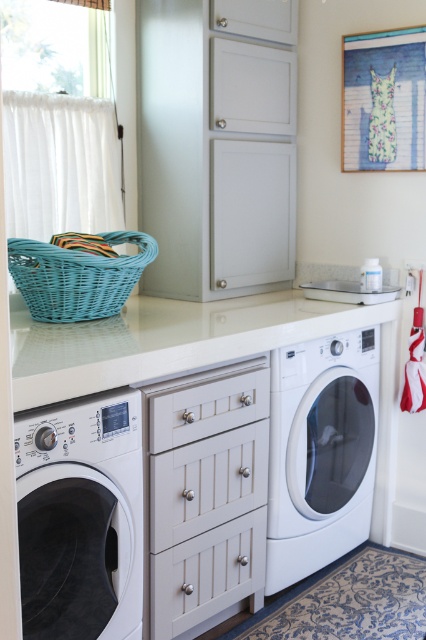
Does point (37, 602) come farther from viewer compared to point (57, 273)?

No, (37, 602) is closer to viewer.

Does white glossy washing machine at lower left appear on the right side of teal wicker basket at upper left?

Correct, you'll find white glossy washing machine at lower left to the right of teal wicker basket at upper left.

Does point (106, 413) lie behind point (46, 292)?

No, (106, 413) is closer to viewer.

Where is `white glossy washing machine at lower left`? This screenshot has height=640, width=426. white glossy washing machine at lower left is located at coordinates (80, 518).

Between white glossy washing machine at lower right and teal wicker basket at upper left, which one is positioned higher?

Positioned higher is teal wicker basket at upper left.

Which is behind, point (308, 538) or point (40, 259)?

Positioned behind is point (308, 538).

Between point (287, 525) and point (104, 314), which one is positioned behind?

Positioned behind is point (287, 525).

Locate an element on the screen. white glossy washing machine at lower right is located at coordinates (321, 452).

How much distance is there between white glossy washing machine at lower left and white glossy washing machine at lower right?

They are 37.39 inches apart.

Is point (124, 636) closer to camera compared to point (350, 401)?

That is True.

The width and height of the screenshot is (426, 640). What are the coordinates of `white glossy washing machine at lower left` in the screenshot? It's located at (80, 518).